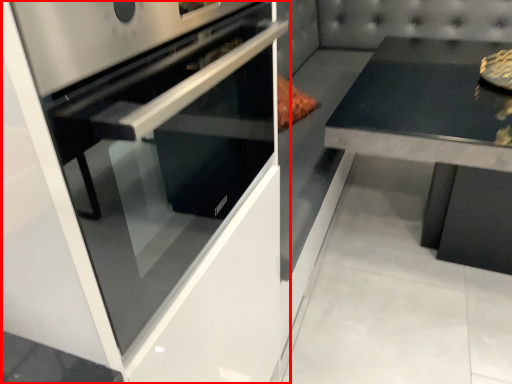
Question: From the image's perspective, what is the correct spatial positioning of home appliance (annotated by the red box) in reference to round table?

Choices:
 (A) below
 (B) above

Answer: (A)